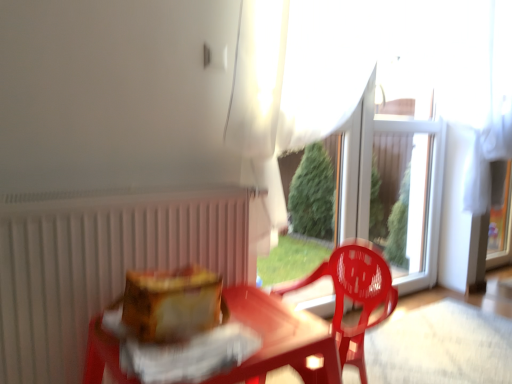
What do you see at coordinates (411, 185) in the screenshot?
I see `transparent glass window at center` at bounding box center [411, 185].

What is the approximate height of white sheer curtain at upper center?

white sheer curtain at upper center is 3.40 feet tall.

Where is `translucent plastic table at center`? The height and width of the screenshot is (384, 512). translucent plastic table at center is located at coordinates (279, 337).

Measure the distance between white matte radiator at left and camera.

A distance of 3.40 feet exists between white matte radiator at left and camera.

Image resolution: width=512 pixels, height=384 pixels. What do you see at coordinates (100, 265) in the screenshot?
I see `white matte radiator at left` at bounding box center [100, 265].

The image size is (512, 384). What are the coordinates of `transparent glass window at center` in the screenshot? It's located at (411, 185).

Is translucent plastic chair at center to the left of translucent plastic table at center from the viewer's perspective?

In fact, translucent plastic chair at center is to the right of translucent plastic table at center.

What's the angular difference between translucent plastic chair at center and translucent plastic table at center's facing directions?

90 degrees.

From a real-world perspective, is translucent plastic chair at center physically located above or below translucent plastic table at center?

translucent plastic chair at center is above translucent plastic table at center.

Which of these two, translucent plastic chair at center or translucent plastic table at center, stands taller?

With more height is translucent plastic chair at center.

Does white matte radiator at left have a lesser height compared to translucent plastic chair at center?

Incorrect, the height of white matte radiator at left does not fall short of that of translucent plastic chair at center.

Which of these two, white matte radiator at left or translucent plastic chair at center, is thinner?

Thinner between the two is white matte radiator at left.

Is white matte radiator at left in front of or behind translucent plastic chair at center in the image?

Clearly, white matte radiator at left is in front of translucent plastic chair at center.

Who is taller, white sheer curtain at upper center or white matte radiator at left?

With more height is white sheer curtain at upper center.

Can you confirm if white sheer curtain at upper center is wider than white matte radiator at left?

Yes, white sheer curtain at upper center is wider than white matte radiator at left.

How many degrees apart are the facing directions of white sheer curtain at upper center and white matte radiator at left?

The angle between the facing direction of white sheer curtain at upper center and the facing direction of white matte radiator at left is 0.555 degrees.

Does point (321, 113) appear closer or farther from the camera than point (189, 247)?

Point (321, 113) is positioned farther from the camera compared to point (189, 247).

From a real-world perspective, is white sheer curtain at upper center positioned above or below translucent plastic chair at center?

white sheer curtain at upper center is situated higher than translucent plastic chair at center in the real world.

What's the angular difference between white sheer curtain at upper center and translucent plastic chair at center's facing directions?

89.2 degrees separate the facing orientations of white sheer curtain at upper center and translucent plastic chair at center.

Visually, is white sheer curtain at upper center positioned to the left or to the right of translucent plastic chair at center?

Clearly, white sheer curtain at upper center is on the right of translucent plastic chair at center in the image.

Locate an element on the screen. chair below the white sheer curtain at upper center (from a real-world perspective) is located at coordinates (354, 295).

Is translucent plastic table at center in front of or behind translucent plastic chair at center in the image?

translucent plastic table at center is in front of translucent plastic chair at center.

From a real-world perspective, who is located lower, translucent plastic table at center or translucent plastic chair at center?

translucent plastic table at center.

Between translucent plastic table at center and translucent plastic chair at center, which one has less height?

With less height is translucent plastic table at center.

Does translucent plastic chair at center appear on the right side of white matte radiator at left?

Indeed, translucent plastic chair at center is positioned on the right side of white matte radiator at left.

How different are the orientations of translucent plastic chair at center and white matte radiator at left in degrees?

89.8 degrees separate the facing orientations of translucent plastic chair at center and white matte radiator at left.

Is translucent plastic chair at center situated inside white matte radiator at left or outside?

translucent plastic chair at center is spatially situated outside white matte radiator at left.

Is translucent plastic chair at center smaller than white matte radiator at left?

No, translucent plastic chair at center is not smaller than white matte radiator at left.

Can you confirm if translucent plastic chair at center is wider than white sheer curtain at upper center?

Yes, translucent plastic chair at center is wider than white sheer curtain at upper center.

Identify the location of curtain positioned vertically above the translucent plastic chair at center (from a real-world perspective). (293, 76).

Consider the image. Does translucent plastic chair at center have a smaller size compared to white sheer curtain at upper center?

Yes.

Is translucent plastic chair at center in contact with white sheer curtain at upper center?

No.

Where is `chair above the translucent plastic table at center (from a real-world perspective)`? chair above the translucent plastic table at center (from a real-world perspective) is located at coordinates (354, 295).

The height and width of the screenshot is (384, 512). What are the coordinates of `chair that appears below the white matte radiator at left (from the image's perspective)` in the screenshot? It's located at (354, 295).

Looking at the image, which one is located closer to white sheer curtain at upper center, transparent glass window at center or white matte radiator at left?

Based on the image, white matte radiator at left appears to be nearer to white sheer curtain at upper center.

From the image, which object appears to be nearer to white sheer curtain at upper center, transparent plastic glass door at center or transparent glass window at center?

transparent plastic glass door at center is positioned closer to the anchor white sheer curtain at upper center.

Estimate the real-world distances between objects in this image. Which object is further from transparent plastic glass door at center, translucent plastic chair at center or white matte radiator at left?

white matte radiator at left.

When comparing their distances from white sheer curtain at upper center, does transparent glass window at center or transparent plastic glass door at center seem further?

Based on the image, transparent glass window at center appears to be further to white sheer curtain at upper center.

Which object lies nearer to the anchor point transparent glass window at center, white sheer curtain at upper center or transparent plastic glass door at center?

transparent plastic glass door at center.

Looking at the image, which one is located closer to translucent plastic chair at center, white sheer curtain at upper center or white matte radiator at left?

white sheer curtain at upper center is positioned closer to the anchor translucent plastic chair at center.

Considering their positions, is transparent glass window at center positioned closer to transparent plastic glass door at center than white matte radiator at left?

transparent glass window at center lies closer to transparent plastic glass door at center than the other object.

Looking at the image, which one is located closer to transparent plastic glass door at center, white sheer curtain at upper center or transparent glass window at center?

Among the two, transparent glass window at center is located nearer to transparent plastic glass door at center.

Where is `chair between white matte radiator at left and transparent glass window at center`? Image resolution: width=512 pixels, height=384 pixels. chair between white matte radiator at left and transparent glass window at center is located at coordinates (354, 295).

Locate an element on the screen. The image size is (512, 384). curtain positioned between translucent plastic table at center and transparent plastic glass door at center from near to far is located at coordinates (293, 76).

Where is `curtain situated between white matte radiator at left and transparent plastic glass door at center from left to right`? The width and height of the screenshot is (512, 384). curtain situated between white matte radiator at left and transparent plastic glass door at center from left to right is located at coordinates (293, 76).

What are the coordinates of `chair between white sheer curtain at upper center and translucent plastic table at center in the up-down direction` in the screenshot? It's located at (354, 295).